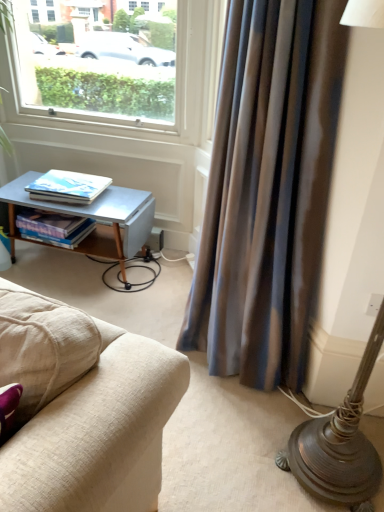
Find the location of `free space above matte white book at left, which is counted as the second book, starting from the bottom (from a real-world perspective)`. free space above matte white book at left, which is counted as the second book, starting from the bottom (from a real-world perspective) is located at coordinates point(71,182).